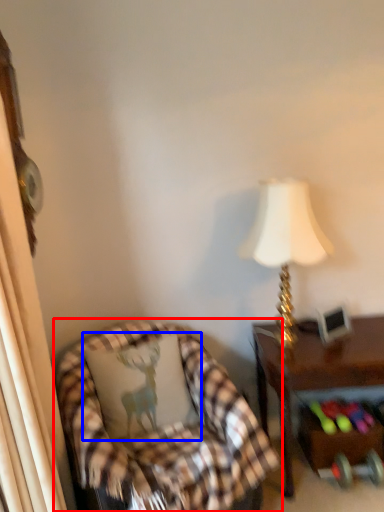
Question: Which point is further to the camera, chair (highlighted by a red box) or pillow (highlighted by a blue box)?

Choices:
 (A) chair
 (B) pillow

Answer: (B)